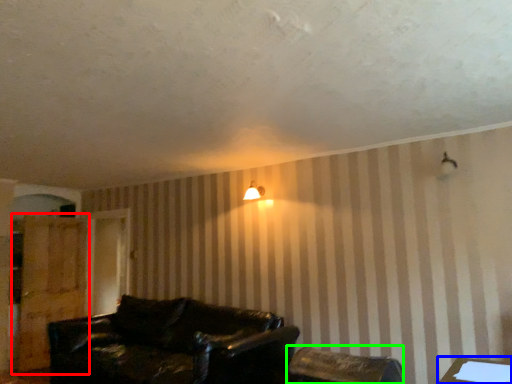
Question: Considering the real-world distances, which object is farthest from dresser (highlighted by a red box)? table (highlighted by a blue box) or chair (highlighted by a green box)?

Choices:
 (A) table
 (B) chair

Answer: (A)